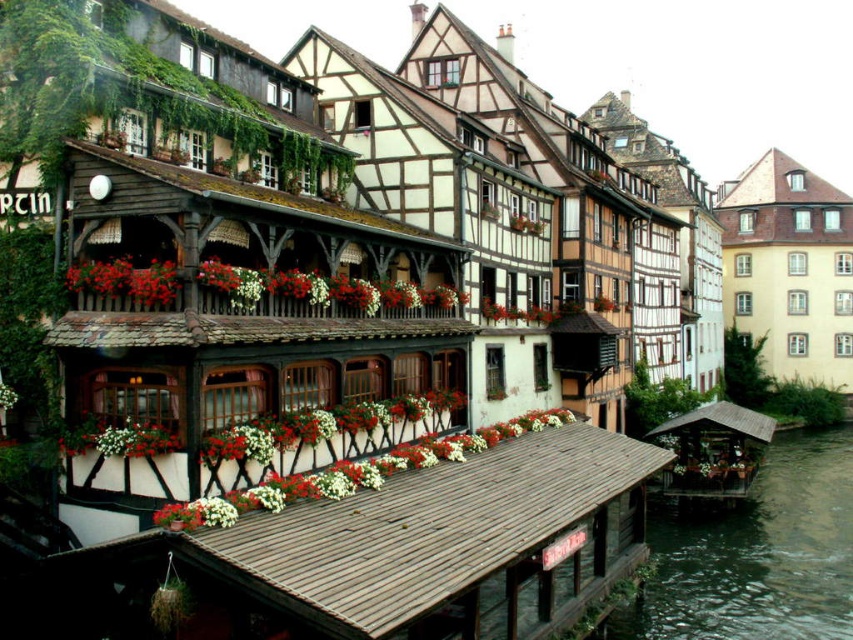
Question: Can you confirm if white matte flower at lower left is bigger than white matte flower at center?

Choices:
 (A) no
 (B) yes

Answer: (A)

Question: Is the position of white matte flower at lower left more distant than that of white matte flower at center?

Choices:
 (A) no
 (B) yes

Answer: (A)

Question: Which of the following is the farthest from the observer?

Choices:
 (A) (761, 502)
 (B) (566, 412)
 (C) (154, 442)

Answer: (A)

Question: Which of these objects is positioned farthest from the white matte flowers at center?

Choices:
 (A) greenish water at lower right
 (B) white matte flower box at center
 (C) white matte flower at lower left

Answer: (A)

Question: Does greenish water at lower right come in front of white matte flower at center?

Choices:
 (A) yes
 (B) no

Answer: (B)

Question: Which object is positioned farthest from the white matte flower box at center?

Choices:
 (A) vivid red petals at center
 (B) white matte flowers at center
 (C) white matte flower at center

Answer: (B)